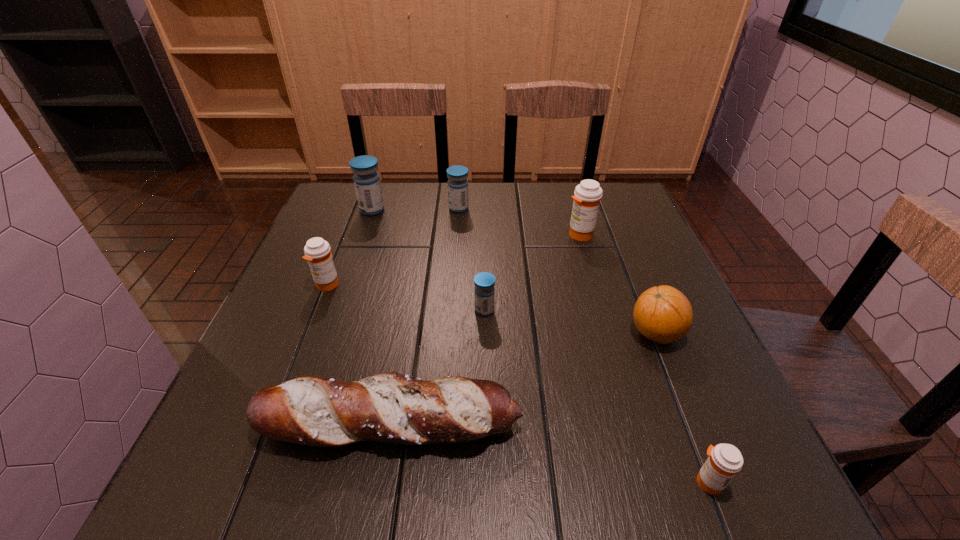
The width and height of the screenshot is (960, 540). I want to click on the smallest blue medicine, so click(484, 292).

I want to click on the rightmost medicine, so click(x=725, y=460).

Identify the location of the nearest medicine. The height and width of the screenshot is (540, 960). (725, 460).

Locate an element on the screen. vacant space located on the back of the farthest orange medicine is located at coordinates (572, 209).

Find the location of a particular element. vacant space positioned 0.160m on the right of the biggest blue medicine is located at coordinates (442, 210).

The height and width of the screenshot is (540, 960). What are the coordinates of `blank space located on the left of the third medicine from left to right` in the screenshot? It's located at (372, 208).

Where is `free space located on the right of the leftmost orange medicine`? free space located on the right of the leftmost orange medicine is located at coordinates (491, 285).

Where is `free space located on the back of the orange orange`? This screenshot has width=960, height=540. free space located on the back of the orange orange is located at coordinates (611, 220).

Identify the location of vacant space located on the right of the baguet. (629, 424).

Image resolution: width=960 pixels, height=540 pixels. Find the location of `free spot located 0.290m on the left of the rightmost blue medicine`. free spot located 0.290m on the left of the rightmost blue medicine is located at coordinates (340, 310).